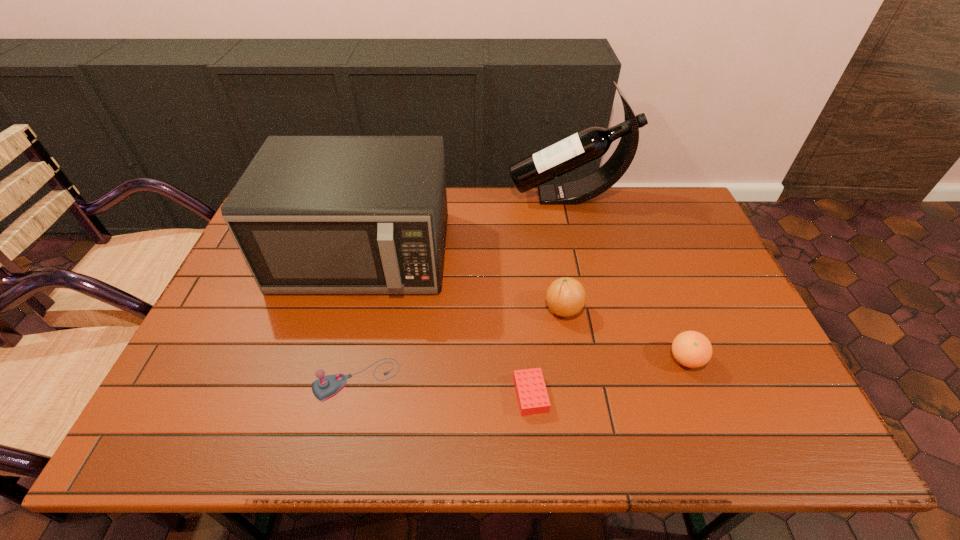
Where is `free space that satisfies the following two spatial constraints: 1. on the stand of the wine bottle; 2. on the front-facing side of the second tallest object`? free space that satisfies the following two spatial constraints: 1. on the stand of the wine bottle; 2. on the front-facing side of the second tallest object is located at coordinates (581, 253).

Locate an element on the screen. free space that satisfies the following two spatial constraints: 1. on the front-facing side of the joystick; 2. on the right side of the microwave oven is located at coordinates (328, 380).

You are a GUI agent. You are given a task and a screenshot of the screen. Output one action in this format:
    pyautogui.click(x=<x>, y=<y>)
    Task: Click on the blank area in the image that satisfies the following two spatial constraints: 1. on the front-facing side of the left orange; 2. on the left side of the microwave oven
    Image resolution: width=960 pixels, height=540 pixels.
    Given the screenshot: What is the action you would take?
    pyautogui.click(x=348, y=309)

The height and width of the screenshot is (540, 960). I want to click on vacant position in the image that satisfies the following two spatial constraints: 1. on the front-facing side of the second tallest object; 2. on the right side of the fourth shortest object, so click(348, 309).

Identify the location of free space that satisfies the following two spatial constraints: 1. on the stand of the farthest object; 2. on the front-facing side of the fifth shortest object. (581, 253).

Where is `free space that satisfies the following two spatial constraints: 1. on the front-facing side of the microwave oven; 2. on the right side of the right orange`? free space that satisfies the following two spatial constraints: 1. on the front-facing side of the microwave oven; 2. on the right side of the right orange is located at coordinates (334, 359).